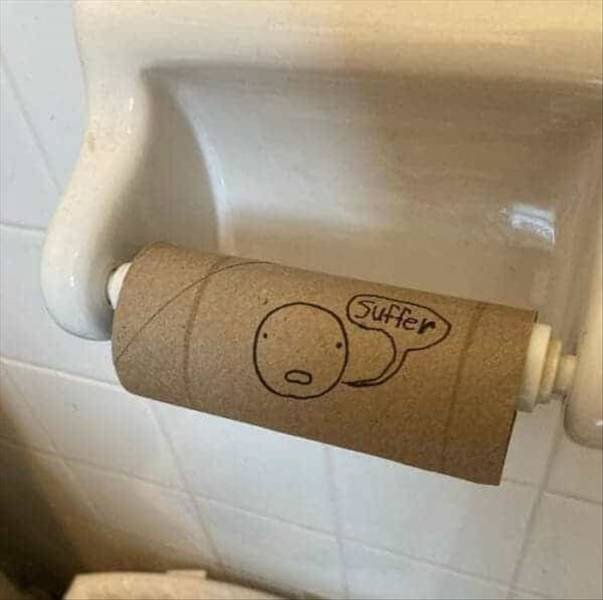
Locate an element on the screen. The width and height of the screenshot is (603, 600). ceramic is located at coordinates (342, 91).